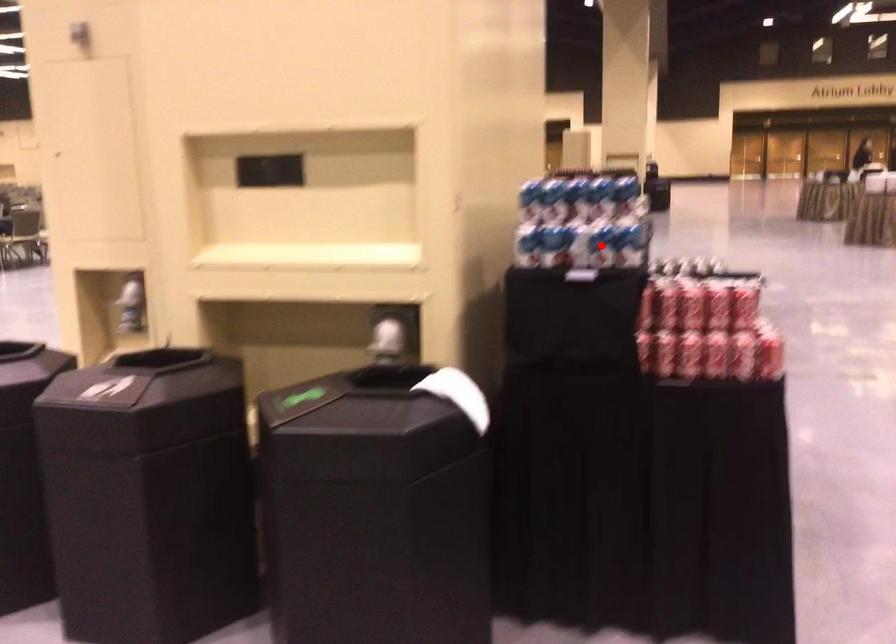
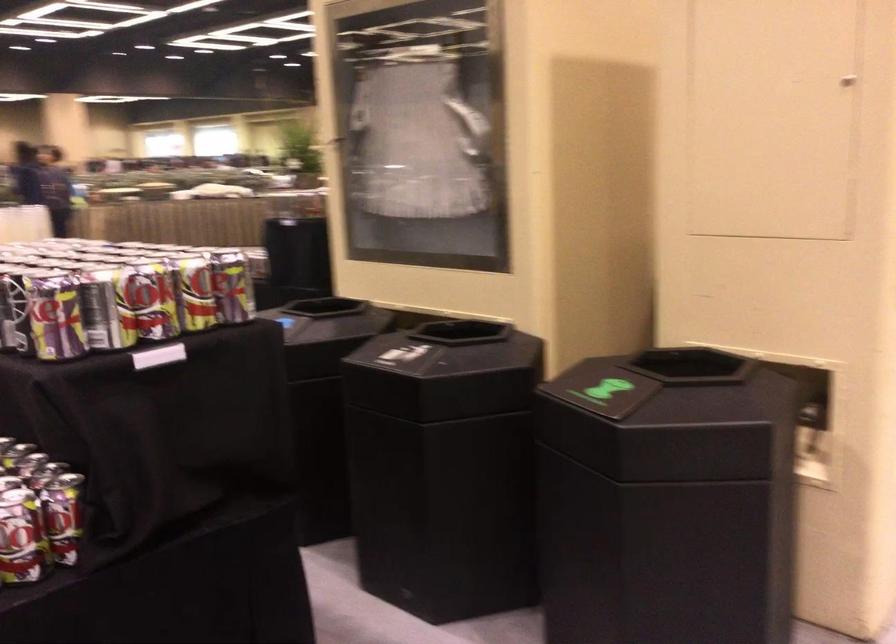
Question: I am providing you with two images of the same scene from different viewpoints. A red point is marked on the first image. At the location where the point appears in image 1, is it still visible in image 2?

Choices:
 (A) Yes
 (B) No

Answer: (B)